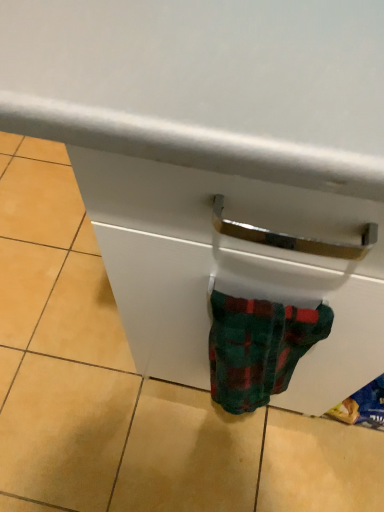
Locate an element on the screen. free space above white glossy drawer at center (from a real-world perspective) is located at coordinates click(91, 337).